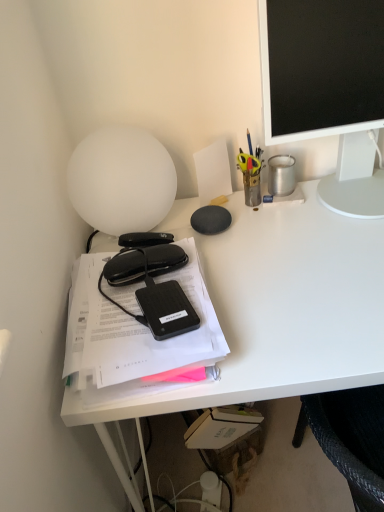
The image size is (384, 512). Find the location of `unoccupied region to the right of metallic silver pen holder at upper right, placed as the 1th stationery when sorted from right to left`. unoccupied region to the right of metallic silver pen holder at upper right, placed as the 1th stationery when sorted from right to left is located at coordinates (x=343, y=190).